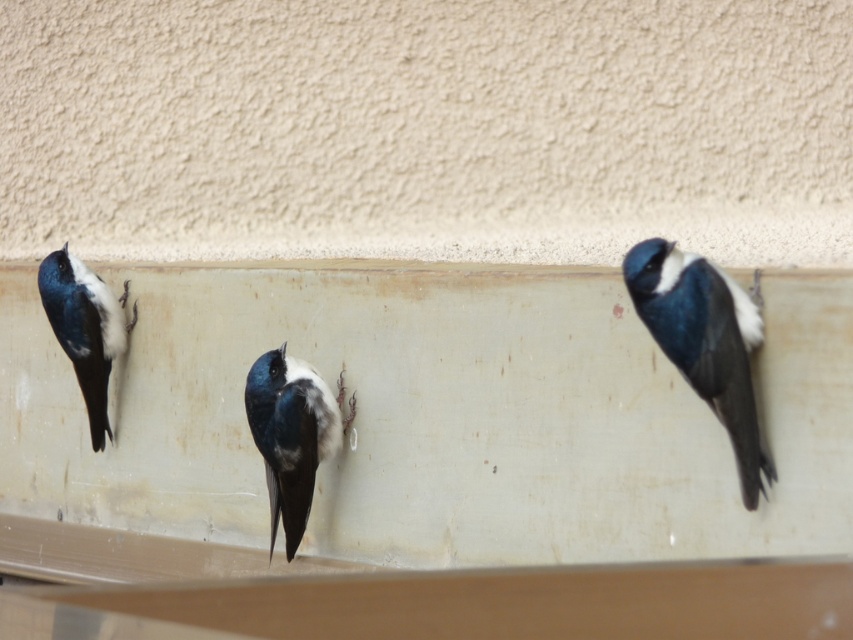
Question: Which point is closer to the camera?

Choices:
 (A) (73, 342)
 (B) (251, 406)

Answer: (B)

Question: Does shiny blue bird at right appear on the right side of blue glossy swallow at center?

Choices:
 (A) no
 (B) yes

Answer: (B)

Question: Which of the following is the farthest from the observer?

Choices:
 (A) blue glossy swallow at center
 (B) shiny blue and white bird at left
 (C) shiny blue bird at right

Answer: (B)

Question: Does shiny blue bird at right appear over blue glossy swallow at center?

Choices:
 (A) no
 (B) yes

Answer: (B)

Question: Observing the image, what is the correct spatial positioning of shiny blue bird at right in reference to blue glossy swallow at center?

Choices:
 (A) left
 (B) right

Answer: (B)

Question: Considering the real-world distances, which object is farthest from the shiny blue bird at right?

Choices:
 (A) blue glossy swallow at center
 (B) shiny blue and white bird at left

Answer: (B)